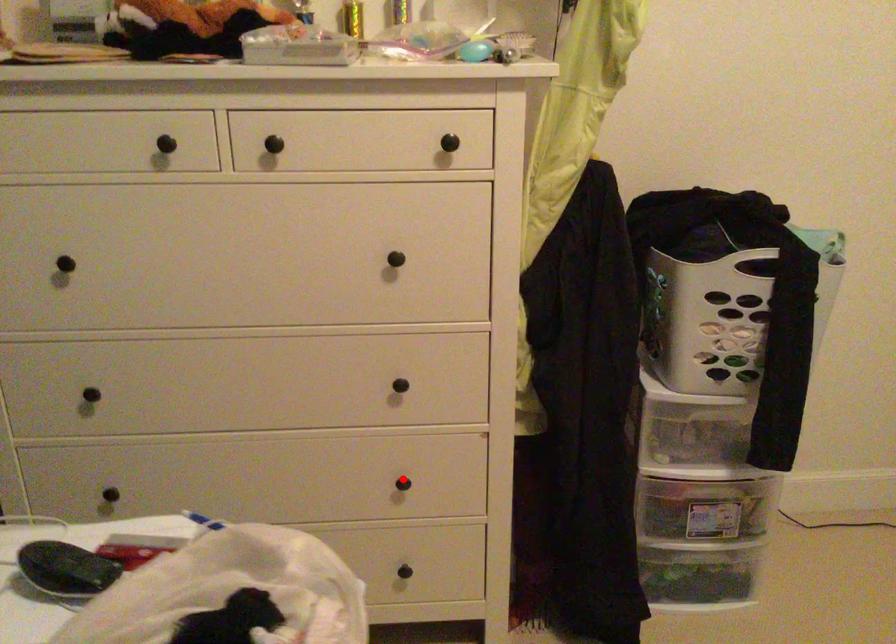
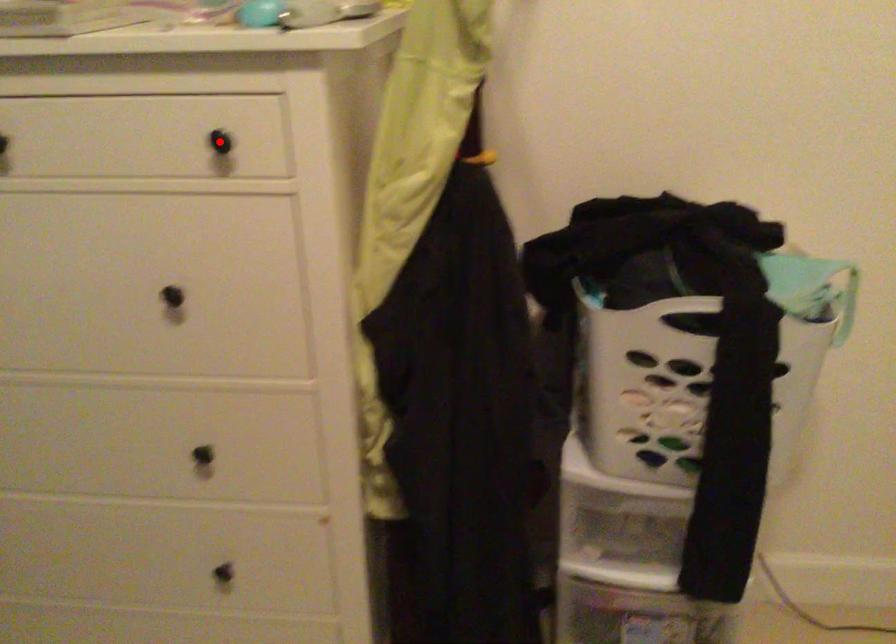
I am providing you with two images of the same scene from different viewpoints. A red point is marked on the first image and another point is marked on the second image. Do the highlighted points in image1 and image2 indicate the same real-world spot?

No